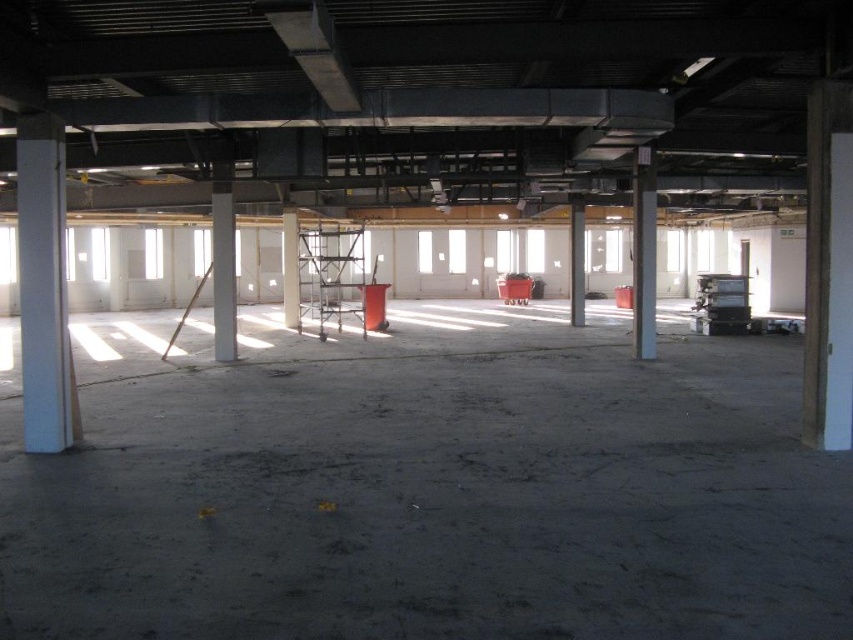
Question: Which object appears closest to the camera in this image?

Choices:
 (A) concrete floor at center
 (B) white concrete pillar at left
 (C) white concrete pillar at center
 (D) white smooth pillar at center

Answer: (A)

Question: Which point appears closest to the camera in this image?

Choices:
 (A) (25, 442)
 (B) (264, 540)
 (C) (282, 285)

Answer: (B)

Question: Which point is closer to the camera taking this photo?

Choices:
 (A) (659, 508)
 (B) (294, 289)
 (C) (28, 378)

Answer: (A)

Question: From the image, what is the correct spatial relationship of concrete floor at center in relation to white concrete pillar at center?

Choices:
 (A) below
 (B) above

Answer: (A)

Question: Does white concrete pillar at left appear on the left side of white smooth pillar at center?

Choices:
 (A) yes
 (B) no

Answer: (B)

Question: Is concrete floor at center thinner than white smooth column at center?

Choices:
 (A) no
 (B) yes

Answer: (A)